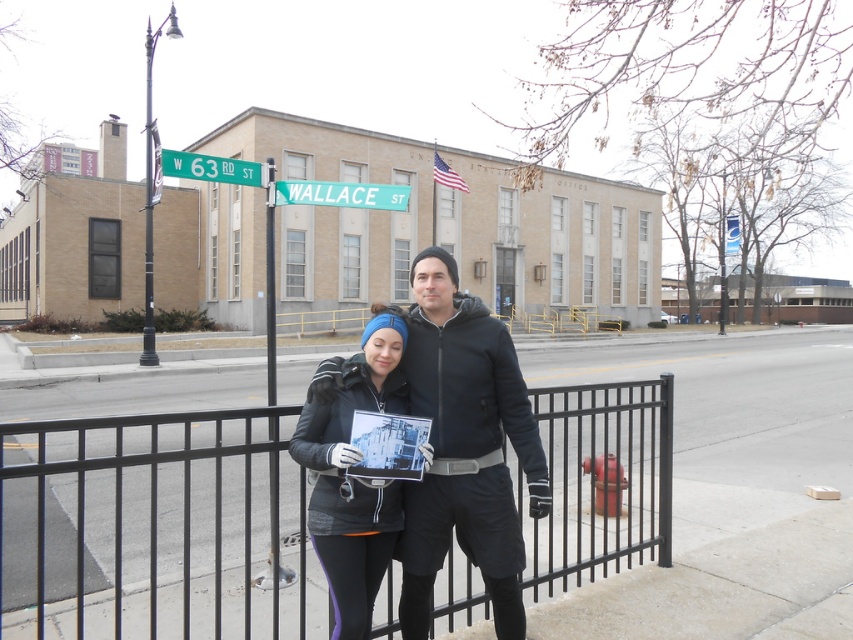
Locate an element on the screen. The image size is (853, 640). brushed metal pole at center is located at coordinates (270, 285).

Does brushed metal pole at center have a greater width compared to green metallic street sign at upper left?

Correct, the width of brushed metal pole at center exceeds that of green metallic street sign at upper left.

This screenshot has height=640, width=853. What are the coordinates of `brushed metal pole at center` in the screenshot? It's located at (270, 285).

Does point (503, 557) lie in front of point (341, 449)?

No, (503, 557) is further to viewer.

Does matte black jacket at center appear on the left side of black fleece jacket at center?

Incorrect, matte black jacket at center is not on the left side of black fleece jacket at center.

Based on the photo, who is more forward, (502,413) or (300,445)?

Point (300,445) is more forward.

Identify the location of matte black jacket at center. The image size is (853, 640). (465, 448).

How much distance is there between black fleece jacket at center and green metallic street sign at upper left?

black fleece jacket at center is 3.23 meters away from green metallic street sign at upper left.

In the scene shown: Is black fleece jacket at center smaller than green metallic street sign at upper left?

Yes.

Is point (370, 394) positioned before point (172, 168)?

That is True.

Locate an element on the screen. This screenshot has height=640, width=853. black fleece jacket at center is located at coordinates [352, 477].